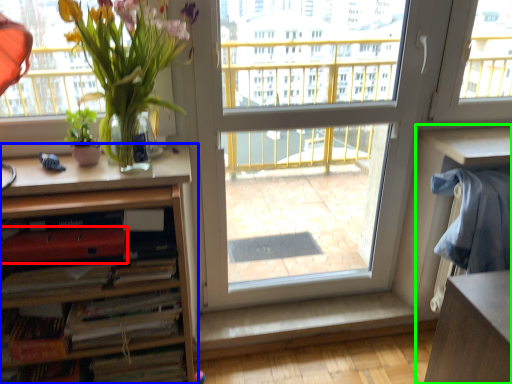
Question: Estimate the real-world distances between objects in this image. Which object is closer to paperback book (highlighted by a red box), cabinetry (highlighted by a blue box) or computer desk (highlighted by a green box)?

Choices:
 (A) cabinetry
 (B) computer desk

Answer: (A)